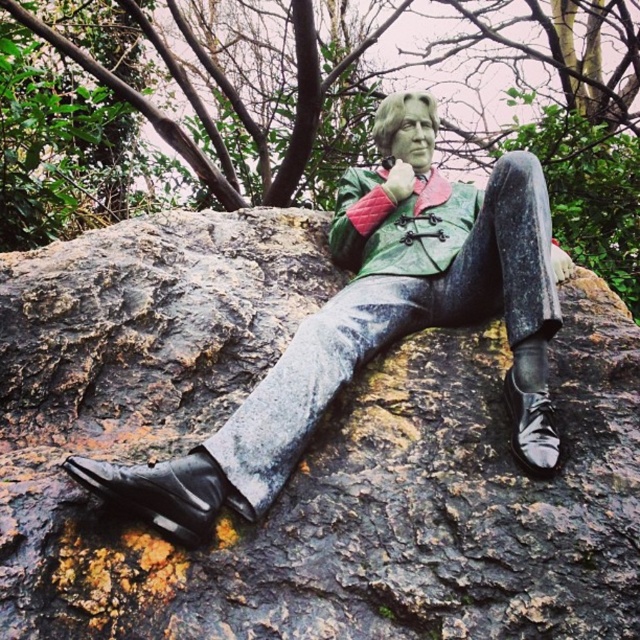
Question: Is shiny black shoes at lower left to the left of black patent leather shoe at lower left from the viewer's perspective?

Choices:
 (A) no
 (B) yes

Answer: (A)

Question: Is green quilted jacket at center smaller than black patent leather shoe at lower left?

Choices:
 (A) yes
 (B) no

Answer: (B)

Question: Among these objects, which one is farthest from the camera?

Choices:
 (A) shiny black shoe at lower right
 (B) shiny black shoes at lower left
 (C) black patent leather shoe at lower left

Answer: (A)

Question: Which point is farther to the camera?

Choices:
 (A) black patent leather shoe at lower left
 (B) shiny black shoe at lower right
 (C) green quilted jacket at center

Answer: (C)

Question: Is shiny black shoes at lower left thinner than shiny black shoe at lower right?

Choices:
 (A) yes
 (B) no

Answer: (B)

Question: Which is nearer to the shiny black shoes at lower left?

Choices:
 (A) green quilted jacket at center
 (B) shiny black shoe at lower right

Answer: (A)